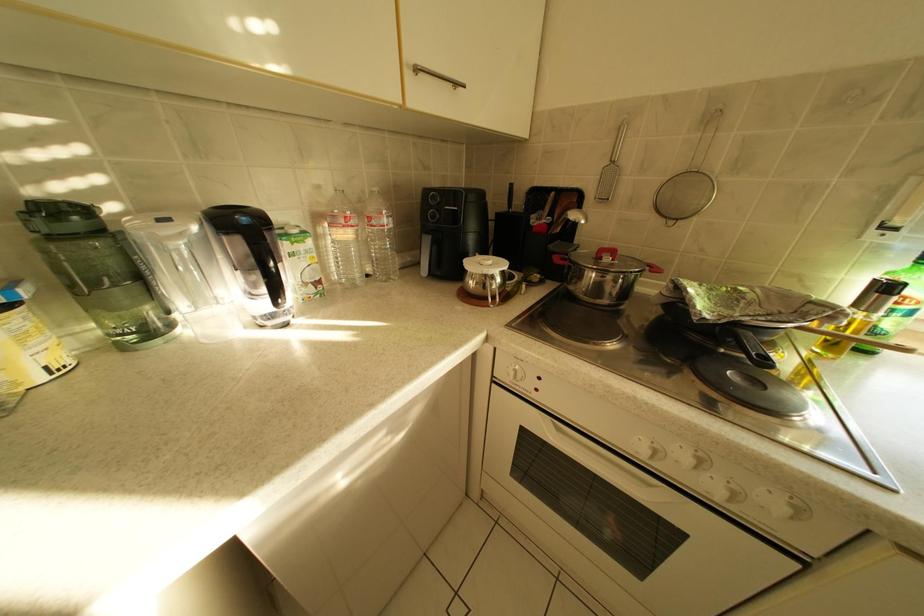
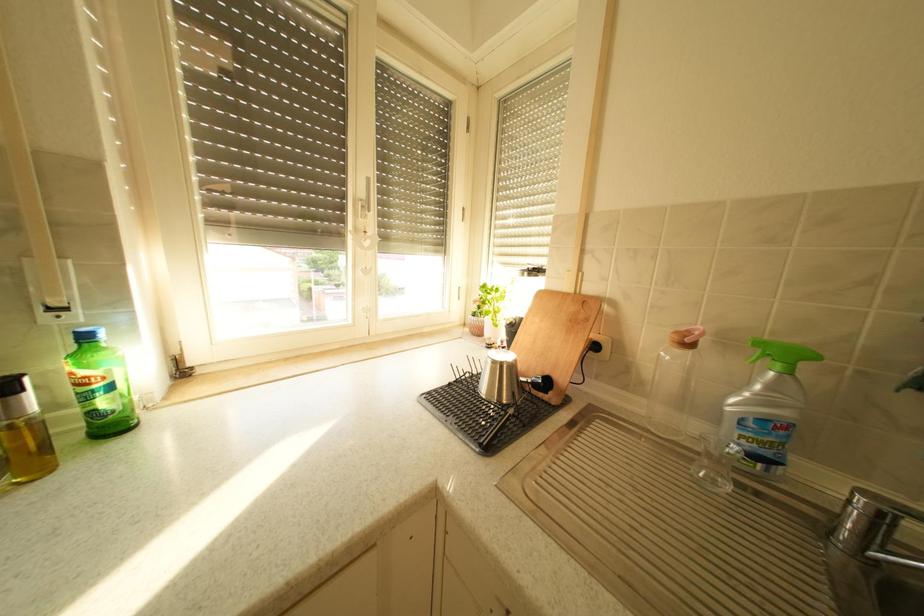
Question: The camera is either moving clockwise (left) or counter-clockwise (right) around the object. The first image is from the beginning of the video and the second image is from the end. Is the camera moving left or right when shooting the video?

Choices:
 (A) Left
 (B) Right

Answer: (A)